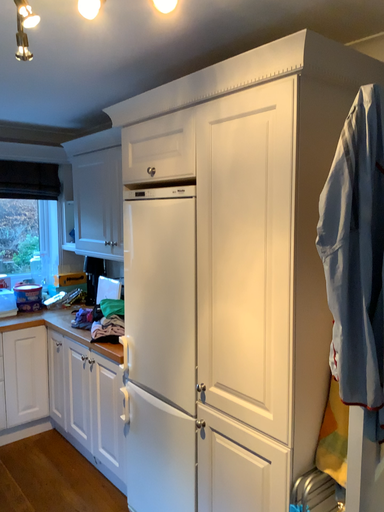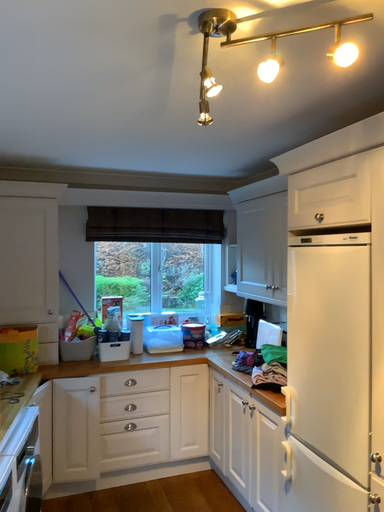
Question: Which way did the camera rotate in the video?

Choices:
 (A) rotated left
 (B) rotated right

Answer: (A)